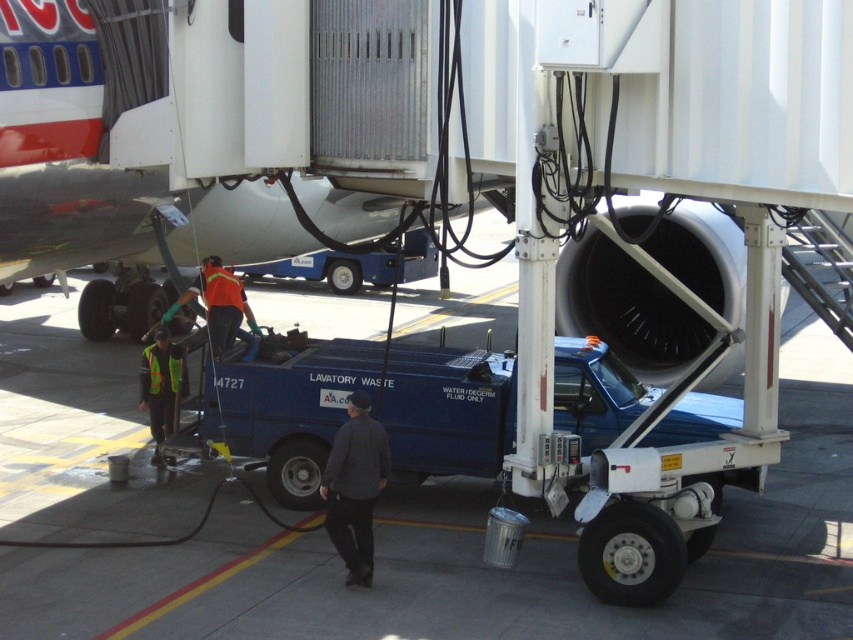
Question: Is metallic silver airplane at upper left in front of dark gray sweater at center?

Choices:
 (A) no
 (B) yes

Answer: (A)

Question: Which of the following is the closest to the observer?

Choices:
 (A) blue metallic truck at lower center
 (B) dark gray sweater at center

Answer: (A)

Question: Which of the following is the farthest from the observer?

Choices:
 (A) (154, 376)
 (B) (339, 449)
 (C) (74, 108)

Answer: (A)

Question: Among these objects, which one is farthest from the camera?

Choices:
 (A) dark gray sweater at center
 (B) blue metallic truck at lower center

Answer: (A)

Question: Can you confirm if metallic silver airplane at upper left is positioned below reflective yellow vest at center?

Choices:
 (A) no
 (B) yes

Answer: (A)

Question: Is dark gray sweater at center bigger than reflective yellow vest at center?

Choices:
 (A) no
 (B) yes

Answer: (A)